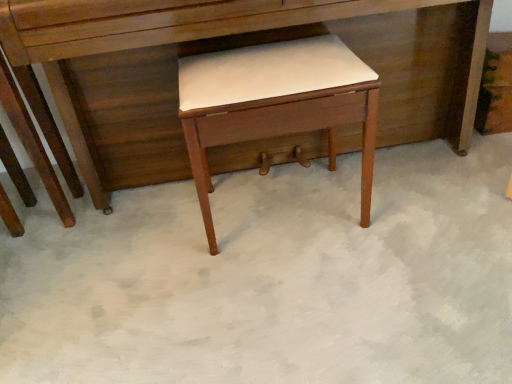
Question: From the image's perspective, is matte wood desk at center above or below matte wood stool at center?

Choices:
 (A) below
 (B) above

Answer: (B)

Question: Is matte wood desk at center to the left or to the right of matte wood stool at center in the image?

Choices:
 (A) left
 (B) right

Answer: (A)

Question: Would you say matte wood desk at center is inside or outside matte wood stool at center?

Choices:
 (A) inside
 (B) outside

Answer: (B)

Question: Considering the positions of matte wood stool at center and matte wood desk at center in the image, is matte wood stool at center bigger or smaller than matte wood desk at center?

Choices:
 (A) big
 (B) small

Answer: (B)

Question: In terms of height, does matte wood stool at center look taller or shorter compared to matte wood desk at center?

Choices:
 (A) short
 (B) tall

Answer: (A)

Question: Is matte wood stool at center wider or thinner than matte wood desk at center?

Choices:
 (A) thin
 (B) wide

Answer: (A)

Question: Does point (309, 59) appear closer or farther from the camera than point (308, 0)?

Choices:
 (A) farther
 (B) closer

Answer: (A)